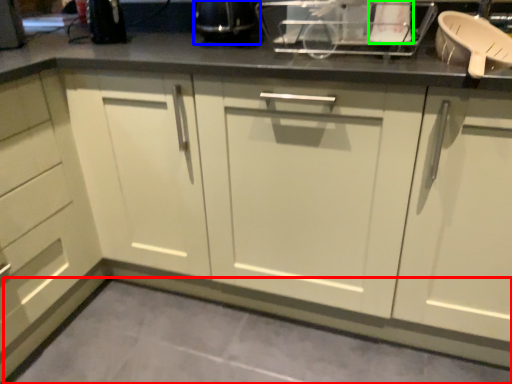
Question: Which object is the farthest from concrete (highlighted by a red box)? Choose among these: appliance (highlighted by a blue box) or appliance (highlighted by a green box).

Choices:
 (A) appliance
 (B) appliance

Answer: (B)